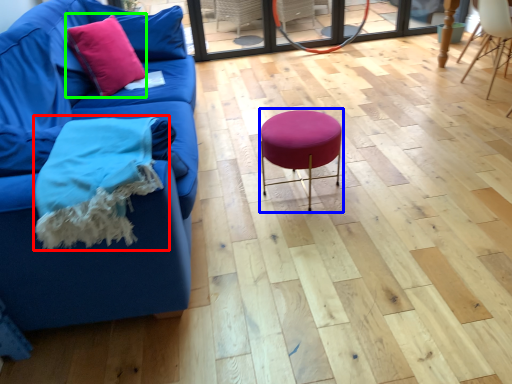
Question: Estimate the real-world distances between objects in this image. Which object is closer to blanket (highlighted by a red box), bar stool (highlighted by a blue box) or throw pillow (highlighted by a green box)?

Choices:
 (A) bar stool
 (B) throw pillow

Answer: (A)